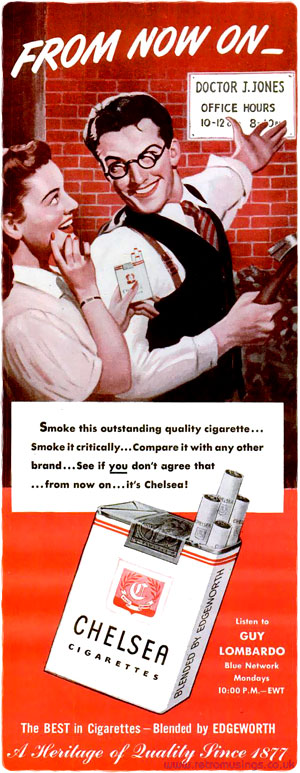
The width and height of the screenshot is (300, 773). I want to click on red brick wall, so click(261, 220).